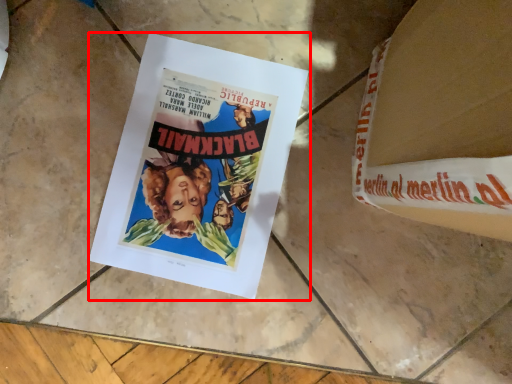
Question: Where is poster (annotated by the red box) located in relation to paperback book in the image?

Choices:
 (A) right
 (B) left

Answer: (B)